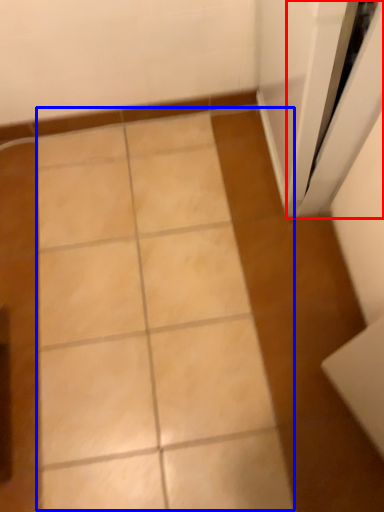
Question: Which point is closer to the camera, screen door (highlighted by a red box) or ceramic tile (highlighted by a blue box)?

Choices:
 (A) screen door
 (B) ceramic tile

Answer: (A)